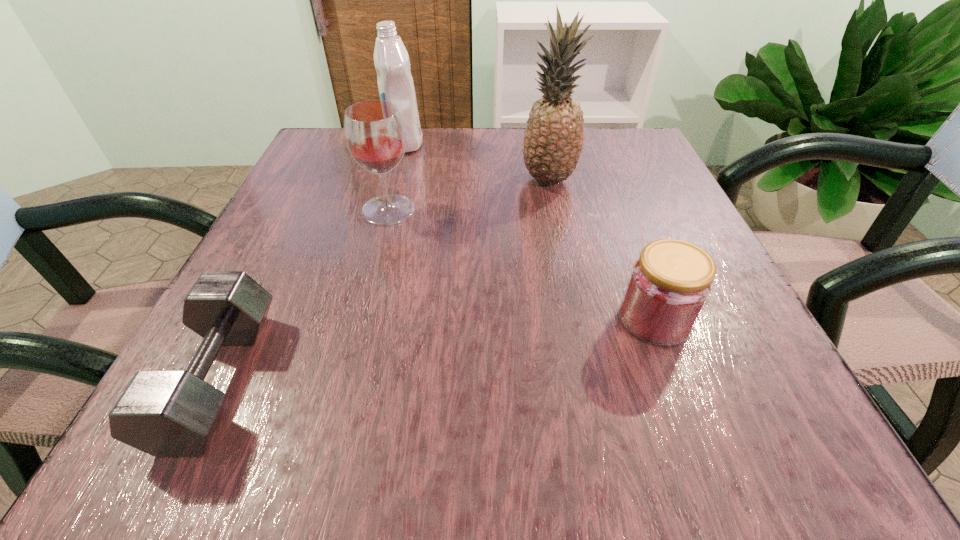
The height and width of the screenshot is (540, 960). Find the location of `free space between the third tallest object and the second tallest object`. free space between the third tallest object and the second tallest object is located at coordinates (396, 177).

Locate an element on the screen. free space between the pineapple and the farthest object is located at coordinates (476, 161).

Where is `free space between the farthest object and the fourth object from left to right`? This screenshot has width=960, height=540. free space between the farthest object and the fourth object from left to right is located at coordinates [x=476, y=161].

Where is `free space between the pineapple and the rightmost object`? The width and height of the screenshot is (960, 540). free space between the pineapple and the rightmost object is located at coordinates (602, 249).

Identify the location of empty space between the farthest object and the third shortest object. The width and height of the screenshot is (960, 540). (396, 177).

Where is `free space between the second shortest object and the leftmost object`? free space between the second shortest object and the leftmost object is located at coordinates coord(437,349).

The height and width of the screenshot is (540, 960). Find the location of `unoccupied position between the wineglass and the fourth shortest object`. unoccupied position between the wineglass and the fourth shortest object is located at coordinates (396, 177).

Locate an element on the screen. vacant space in between the fourth nearest object and the farthest object is located at coordinates (476, 161).

Where is `object that is the closest to the shortest object`? This screenshot has height=540, width=960. object that is the closest to the shortest object is located at coordinates (374, 131).

I want to click on the fourth closest object to the dumbbell, so click(x=670, y=283).